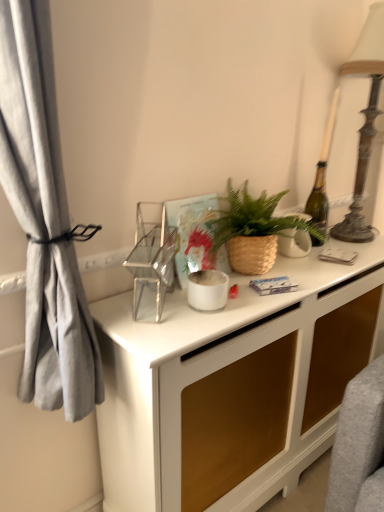
Question: From the image's perspective, is white ceramic vase at center, marked as the 1th appliance in a right-to-left arrangement, located above or below brown woven basket at center?

Choices:
 (A) above
 (B) below

Answer: (B)

Question: From a real-world perspective, is white ceramic vase at center, which is counted as the third appliance, starting from the front, positioned above or below brown woven basket at center?

Choices:
 (A) below
 (B) above

Answer: (A)

Question: Which object is positioned farthest from the white matte pot at center, acting as the 2th appliance starting from the left?

Choices:
 (A) brown woven basket at center
 (B) antique bronze table lamp at right
 (C) white glossy desk at center
 (D) clear glass shelf at center, which is the third appliance from back to front
 (E) white ceramic vase at center, positioned as the first appliance in back-to-front order

Answer: (B)

Question: Estimate the real-world distances between objects in this image. Which object is farther from the antique bronze table lamp at right?

Choices:
 (A) white ceramic vase at center, marked as the 1th appliance in a right-to-left arrangement
 (B) brown woven basket at center
 (C) clear glass shelf at center, positioned as the 3th appliance in right-to-left order
 (D) white glossy desk at center
 (E) white matte pot at center, positioned as the second appliance in back-to-front order

Answer: (C)